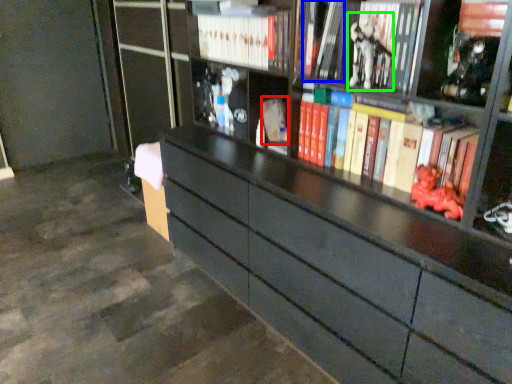
Question: Considering the real-world distances, which object is closest to paperback book (highlighted by a red box)? book (highlighted by a blue box) or toy (highlighted by a green box).

Choices:
 (A) book
 (B) toy

Answer: (A)